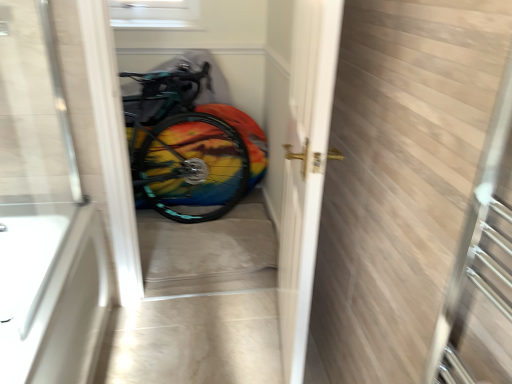
This screenshot has height=384, width=512. I want to click on white glossy bathtub at lower left, so click(x=52, y=292).

You are a GUI agent. You are given a task and a screenshot of the screen. Output one action in this format:
    pyautogui.click(x=<x>, y=<y>)
    Task: Click on the transparent glass door at left
    
    Given the screenshot: What is the action you would take?
    pyautogui.click(x=45, y=214)

What do you see at coordinates (188, 146) in the screenshot? I see `rainbow painted bicycle at center` at bounding box center [188, 146].

Where is `white glossy door handle at center`? Image resolution: width=512 pixels, height=384 pixels. white glossy door handle at center is located at coordinates (305, 170).

Is transparent glass door at left outside of rainbow painted bicycle at center?

transparent glass door at left is positioned outside rainbow painted bicycle at center.

The image size is (512, 384). In the image, there is a rainbow painted bicycle at center. Identify the location of door below it (from the image's perspective). [45, 214].

Considering the positions of points (86, 329) and (239, 135), is point (86, 329) farther from camera compared to point (239, 135)?

No, (86, 329) is in front of (239, 135).

What's the angular difference between white glossy door handle at center and multicolored fabric at center's facing directions?

The angular difference between white glossy door handle at center and multicolored fabric at center is 98.1 degrees.

Could you tell me if white glossy door handle at center is turned towards multicolored fabric at center?

No, white glossy door handle at center does not turn towards multicolored fabric at center.

Is white glossy door handle at center inside or outside of multicolored fabric at center?

white glossy door handle at center exists outside the volume of multicolored fabric at center.

Where is `bicycle on the right side of transparent glass door at left`? The image size is (512, 384). bicycle on the right side of transparent glass door at left is located at coordinates (188, 146).

Is there a large distance between rainbow painted bicycle at center and transparent glass door at left?

Yes, rainbow painted bicycle at center is far from transparent glass door at left.

Consider the image. Which is closer to the camera, (144, 158) or (78, 268)?

The point (78, 268) is more forward.

Is rainbow painted bicycle at center taller or shorter than transparent glass door at left?

In the image, rainbow painted bicycle at center appears to be shorter than transparent glass door at left.

Is white glossy door handle at center shorter than rainbow painted bicycle at center?

Incorrect, the height of white glossy door handle at center does not fall short of that of rainbow painted bicycle at center.

Is white glossy door handle at center at the left side of rainbow painted bicycle at center?

Incorrect, white glossy door handle at center is not on the left side of rainbow painted bicycle at center.

Find the location of `screen door below the rainbow painted bicycle at center (from the image's perspective)`. screen door below the rainbow painted bicycle at center (from the image's perspective) is located at coordinates (305, 170).

Is transparent glass door at left not close to white glossy door handle at center?

No, there isn't a large distance between transparent glass door at left and white glossy door handle at center.

From a real-world perspective, is transparent glass door at left physically located above or below white glossy door handle at center?

transparent glass door at left is above white glossy door handle at center.

Who is more distant, white glossy bathtub at lower left or rainbow painted bicycle at center?

rainbow painted bicycle at center is more distant.

Is white glossy bathtub at lower left spatially inside rainbow painted bicycle at center, or outside of it?

white glossy bathtub at lower left exists outside the volume of rainbow painted bicycle at center.

How many degrees apart are the facing directions of white glossy bathtub at lower left and rainbow painted bicycle at center?

90.4 degrees separate the facing orientations of white glossy bathtub at lower left and rainbow painted bicycle at center.

Where is `bicycle located on the right of white glossy bathtub at lower left`? bicycle located on the right of white glossy bathtub at lower left is located at coordinates (188, 146).

Is multicolored fabric at center inside white glossy bathtub at lower left?

No, multicolored fabric at center is not inside white glossy bathtub at lower left.

Is white glossy bathtub at lower left directly adjacent to multicolored fabric at center?

No, white glossy bathtub at lower left is not with multicolored fabric at center.

Consider the image. In terms of size, does white glossy bathtub at lower left appear bigger or smaller than multicolored fabric at center?

Considering their sizes, white glossy bathtub at lower left takes up more space than multicolored fabric at center.

Image resolution: width=512 pixels, height=384 pixels. In order to click on door on the left of the rainbow painted bicycle at center in this screenshot , I will do `click(45, 214)`.

Find the location of a particular element. This screenshot has width=512, height=384. screen door that appears above the multicolored fabric at center (from a real-world perspective) is located at coordinates (305, 170).

From the image, which object appears to be farther from transparent glass door at left, rainbow painted bicycle at center or white glossy bathtub at lower left?

The object further to transparent glass door at left is rainbow painted bicycle at center.

Based on their spatial positions, is multicolored fabric at center or transparent glass door at left closer to white glossy bathtub at lower left?

transparent glass door at left lies closer to white glossy bathtub at lower left than the other object.

Considering their positions, is transparent glass door at left positioned closer to multicolored fabric at center than rainbow painted bicycle at center?

Among the two, rainbow painted bicycle at center is located nearer to multicolored fabric at center.

Based on their spatial positions, is transparent glass door at left or white glossy bathtub at lower left closer to multicolored fabric at center?

white glossy bathtub at lower left is closer to multicolored fabric at center.

From the image, which object appears to be farther from multicolored fabric at center, white glossy door handle at center or white glossy bathtub at lower left?

white glossy door handle at center is positioned further to the anchor multicolored fabric at center.

Estimate the real-world distances between objects in this image. Which object is further from rainbow painted bicycle at center, multicolored fabric at center or white glossy door handle at center?

The object further to rainbow painted bicycle at center is white glossy door handle at center.

Based on their spatial positions, is transparent glass door at left or rainbow painted bicycle at center further from white glossy bathtub at lower left?

rainbow painted bicycle at center lies further to white glossy bathtub at lower left than the other object.

From the image, which object appears to be nearer to white glossy door handle at center, transparent glass door at left or multicolored fabric at center?

multicolored fabric at center is closer to white glossy door handle at center.

The width and height of the screenshot is (512, 384). I want to click on screen door positioned between transparent glass door at left and multicolored fabric at center from near to far, so click(x=305, y=170).

Locate an element on the screen. This screenshot has height=384, width=512. bath between white glossy door handle at center and rainbow painted bicycle at center in the front-back direction is located at coordinates (52, 292).

Where is `door between white glossy bathtub at lower left and white glossy door handle at center`? The image size is (512, 384). door between white glossy bathtub at lower left and white glossy door handle at center is located at coordinates (45, 214).

At what (x,y) coordinates should I click in order to perform the action: click on bath positioned between transparent glass door at left and rainbow painted bicycle at center from near to far. Please return your answer as a coordinate pair (x, y). The image size is (512, 384). Looking at the image, I should click on (52, 292).